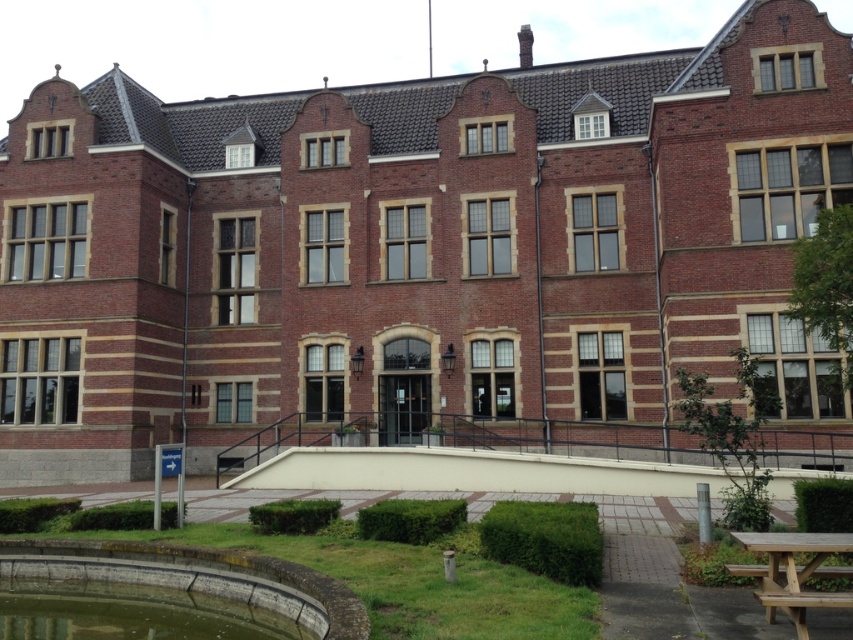
Question: Which point is farther to the camera?

Choices:
 (A) wooden picnic table at lower right
 (B) green mossy pond at lower left

Answer: (B)

Question: Which of the following is the farthest from the observer?

Choices:
 (A) green mossy pond at lower left
 (B) wooden picnic table at lower right

Answer: (A)

Question: Is green mossy pond at lower left below wooden picnic table at lower right?

Choices:
 (A) no
 (B) yes

Answer: (B)

Question: Is green mossy pond at lower left positioned before wooden picnic table at lower right?

Choices:
 (A) no
 (B) yes

Answer: (A)

Question: Can you confirm if green mossy pond at lower left is smaller than wooden picnic table at lower right?

Choices:
 (A) yes
 (B) no

Answer: (B)